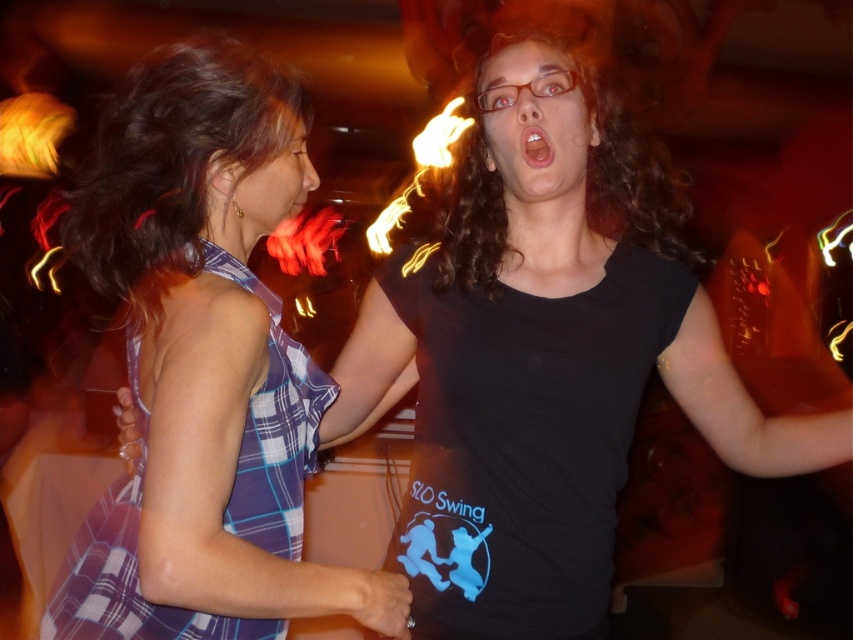
In the scene shown: Please use the coordinates provided to determine the position of the black matte tank top at center relative to the other person in the scene. Is it positioned to the left or right of the other individual?

The black matte tank top at center is located at coordinates point (524, 444), which places it to the right of the other individual in the scene.

You are standing at the back of the room and want to see both the black matte tank top at center and the plaid fabric dress at left. Which one is taller?

The black matte tank top at center is taller than the plaid fabric dress at left according to the description.